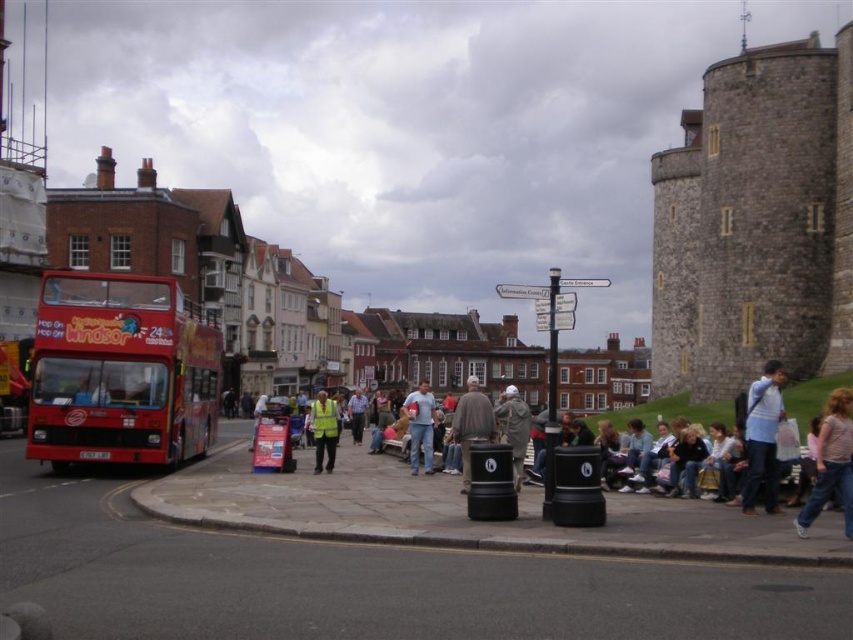
Question: Which point is closer to the camera?

Choices:
 (A) (845, 417)
 (B) (817, 378)
 (C) (430, 433)
 (D) (759, 332)

Answer: (A)

Question: Among these objects, which one is farthest from the camera?

Choices:
 (A) high visibility yellow vest at center
 (B) red matte double-decker bus at left
 (C) denim jeans at center
 (D) gray fabric jacket at center

Answer: (C)

Question: Does gray stone tower at right have a greater width compared to denim jeans at center?

Choices:
 (A) yes
 (B) no

Answer: (A)

Question: Can you confirm if denim jacket at center is wider than pink fabric shirt at lower right?

Choices:
 (A) no
 (B) yes

Answer: (B)

Question: Is red matte double-decker bus at left smaller than gray fabric jacket at center?

Choices:
 (A) yes
 (B) no

Answer: (B)

Question: Which object is positioned closest to the pink fabric shirt at lower right?

Choices:
 (A) high visibility yellow vest at center
 (B) gray woolen hat at center
 (C) gray stone tower at right

Answer: (B)